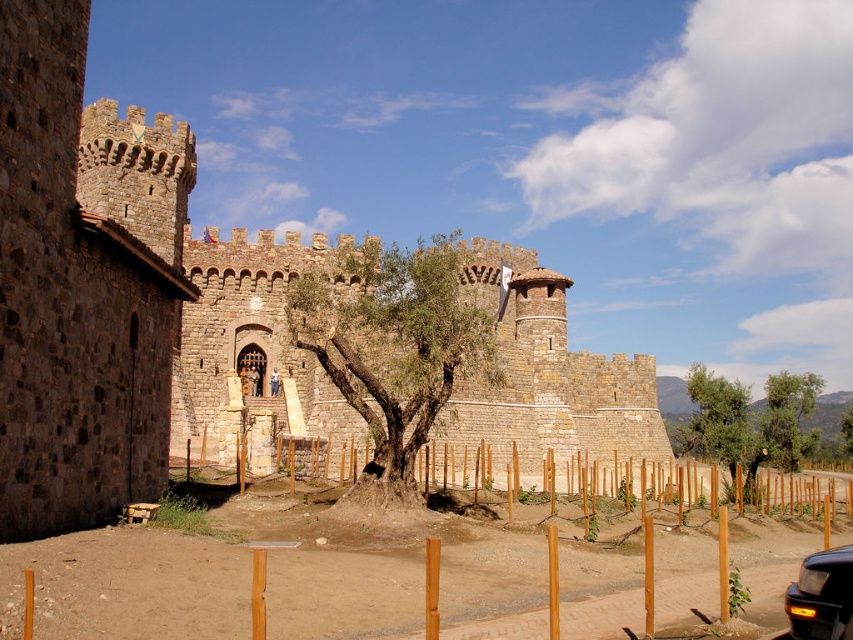
Does point (694, 438) come in front of point (850, 600)?

No, (694, 438) is further to viewer.

Can you confirm if green leafy tree at upper right is smaller than metallic gray car at lower right?

Incorrect, green leafy tree at upper right is not smaller in size than metallic gray car at lower right.

Between point (741, 417) and point (810, 568), which one is positioned behind?

Point (741, 417)

Locate an element on the screen. This screenshot has height=640, width=853. green leafy tree at upper right is located at coordinates (723, 420).

Can you confirm if green rough bark tree at center is positioned to the right of metallic gray car at lower right?

Incorrect, green rough bark tree at center is not on the right side of metallic gray car at lower right.

I want to click on green rough bark tree at center, so click(393, 348).

Which is more to the right, brown stone castle at center or green leafy tree at lower right?

green leafy tree at lower right

Between point (544, 269) and point (788, 440), which one is positioned behind?

Point (544, 269)

Identify the location of brown stone castle at center. Image resolution: width=853 pixels, height=640 pixels. (125, 298).